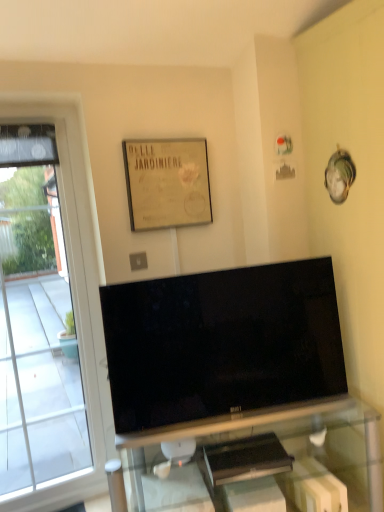
The image size is (384, 512). What do you see at coordinates (48, 314) in the screenshot? I see `transparent glass window at left` at bounding box center [48, 314].

This screenshot has height=512, width=384. What do you see at coordinates (256, 456) in the screenshot?
I see `transparent glass tv stand at center` at bounding box center [256, 456].

Where is `black glossy tv at center`? The width and height of the screenshot is (384, 512). black glossy tv at center is located at coordinates (222, 343).

Is the depth of transparent glass tv stand at center less than that of transparent glass window at left?

Yes, transparent glass tv stand at center is in front of transparent glass window at left.

Is transparent glass tv stand at center next to transparent glass window at left?

No, transparent glass tv stand at center is not in contact with transparent glass window at left.

Can you tell me how much transparent glass tv stand at center and transparent glass window at left differ in facing direction?

The angle between the facing direction of transparent glass tv stand at center and the facing direction of transparent glass window at left is 0.208 degrees.

Are beige paper picture frame at upper center and transparent glass window at left making contact?

No.

In the scene shown: Measure the distance from beige paper picture frame at upper center to transparent glass window at left.

beige paper picture frame at upper center and transparent glass window at left are 24.43 inches apart from each other.

Find the location of a particular element. Image resolution: width=384 pixels, height=512 pixels. window on the left side of beige paper picture frame at upper center is located at coordinates (48, 314).

Between transparent glass window at left and black glossy tv at center, which one is positioned in front?

black glossy tv at center is in front.

From the image's perspective, relative to black glossy tv at center, is transparent glass window at left above or below?

transparent glass window at left is above black glossy tv at center.

In the scene shown: How different are the orientations of transparent glass window at left and black glossy tv at center in degrees?

transparent glass window at left and black glossy tv at center are facing 14.6 degrees away from each other.

Is transparent glass window at left with black glossy tv at center?

No, transparent glass window at left is not next to black glossy tv at center.

From the image's perspective, is black glossy tv at center on beige paper picture frame at upper center?

Incorrect, from the image's perspective, black glossy tv at center is lower than beige paper picture frame at upper center.

From the picture: Is black glossy tv at center to the left of beige paper picture frame at upper center from the viewer's perspective?

No, black glossy tv at center is not to the left of beige paper picture frame at upper center.

Considering the positions of points (113, 329) and (174, 212), is point (113, 329) closer to camera compared to point (174, 212)?

Yes.

I want to click on picture frame that is on the left side of black glossy tv at center, so click(x=167, y=183).

From a real-world perspective, is black glossy tv at center on top of transparent glass tv stand at center?

Indeed, from a real-world perspective, black glossy tv at center stands above transparent glass tv stand at center.

From the image's perspective, which one is positioned lower, black glossy tv at center or transparent glass tv stand at center?

From the image's view, transparent glass tv stand at center is below.

Measure the distance from black glossy tv at center to transparent glass tv stand at center.

They are 29.48 centimeters apart.

Is black glossy tv at center in contact with transparent glass tv stand at center?

They are not placed beside each other.

Is transparent glass tv stand at center to the right of beige paper picture frame at upper center from the viewer's perspective?

Correct, you'll find transparent glass tv stand at center to the right of beige paper picture frame at upper center.

Is transparent glass tv stand at center closer to the viewer compared to beige paper picture frame at upper center?

Yes, transparent glass tv stand at center is in front of beige paper picture frame at upper center.

Is point (340, 408) closer to camera compared to point (136, 153)?

That is False.

From a real-world perspective, relative to beige paper picture frame at upper center, is transparent glass tv stand at center vertically above or below?

In terms of real-world spatial position, transparent glass tv stand at center is below beige paper picture frame at upper center.

Based on their sizes in the image, would you say beige paper picture frame at upper center is bigger or smaller than transparent glass tv stand at center?

In the image, beige paper picture frame at upper center appears to be smaller than transparent glass tv stand at center.

Does beige paper picture frame at upper center have a lesser height compared to transparent glass tv stand at center?

Yes, beige paper picture frame at upper center is shorter than transparent glass tv stand at center.

Is point (206, 159) in front of point (370, 484)?

That is False.

The image size is (384, 512). In order to click on window above the transparent glass tv stand at center (from a real-world perspective) in this screenshot , I will do `click(48, 314)`.

What are the coordinates of `picture frame that is above the transparent glass window at left (from the image's perspective)` in the screenshot? It's located at (167, 183).

Which object lies further to the anchor point transparent glass tv stand at center, transparent glass window at left or beige paper picture frame at upper center?

beige paper picture frame at upper center is further to transparent glass tv stand at center.

Based on the photo, when comparing their distances from beige paper picture frame at upper center, does transparent glass window at left or transparent glass tv stand at center seem further?

Based on the image, transparent glass tv stand at center appears to be further to beige paper picture frame at upper center.

Considering their positions, is beige paper picture frame at upper center positioned closer to black glossy tv at center than transparent glass tv stand at center?

transparent glass tv stand at center lies closer to black glossy tv at center than the other object.

Estimate the real-world distances between objects in this image. Which object is further from beige paper picture frame at upper center, transparent glass tv stand at center or transparent glass window at left?

Among the two, transparent glass tv stand at center is located further to beige paper picture frame at upper center.

From the image, which object appears to be farther from beige paper picture frame at upper center, transparent glass window at left or black glossy tv at center?

transparent glass window at left lies further to beige paper picture frame at upper center than the other object.

Estimate the real-world distances between objects in this image. Which object is further from transparent glass window at left, beige paper picture frame at upper center or black glossy tv at center?

black glossy tv at center lies further to transparent glass window at left than the other object.

When comparing their distances from black glossy tv at center, does transparent glass window at left or beige paper picture frame at upper center seem closer?

Based on the image, beige paper picture frame at upper center appears to be nearer to black glossy tv at center.

From the image, which object appears to be nearer to black glossy tv at center, transparent glass tv stand at center or beige paper picture frame at upper center?

The object closer to black glossy tv at center is transparent glass tv stand at center.

Where is `window between beige paper picture frame at upper center and transparent glass tv stand at center in the vertical direction`? The width and height of the screenshot is (384, 512). window between beige paper picture frame at upper center and transparent glass tv stand at center in the vertical direction is located at coordinates (48, 314).

This screenshot has width=384, height=512. Find the location of `picture frame situated between transparent glass window at left and black glossy tv at center from left to right`. picture frame situated between transparent glass window at left and black glossy tv at center from left to right is located at coordinates (167, 183).

The width and height of the screenshot is (384, 512). What are the coordinates of `television that lies between beige paper picture frame at upper center and transparent glass tv stand at center from top to bottom` in the screenshot? It's located at [x=222, y=343].

At what (x,y) coordinates should I click in order to perform the action: click on television situated between transparent glass window at left and transparent glass tv stand at center from left to right. Please return your answer as a coordinate pair (x, y). The image size is (384, 512). Looking at the image, I should click on (222, 343).